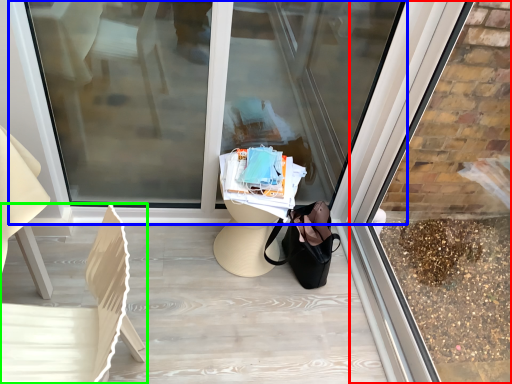
Question: Which object is the closest to the shop window (highlighted by a red box)? Choose among these: shop window (highlighted by a blue box) or chair (highlighted by a green box).

Choices:
 (A) shop window
 (B) chair

Answer: (A)